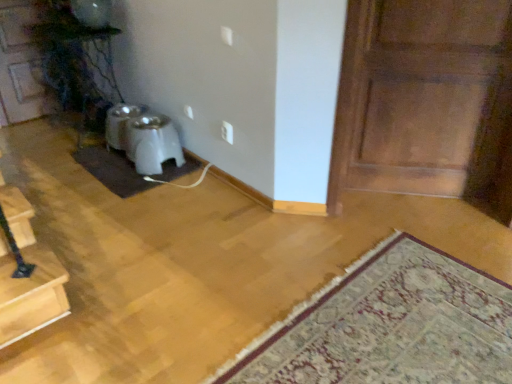
The width and height of the screenshot is (512, 384). In order to click on free point to the left of white plastic pet feeder at center in this screenshot , I will do `click(109, 163)`.